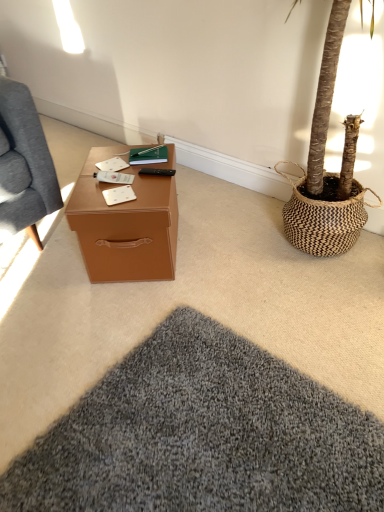
Identify the location of free space in front of white matte notepad at center. The height and width of the screenshot is (512, 384). (115, 208).